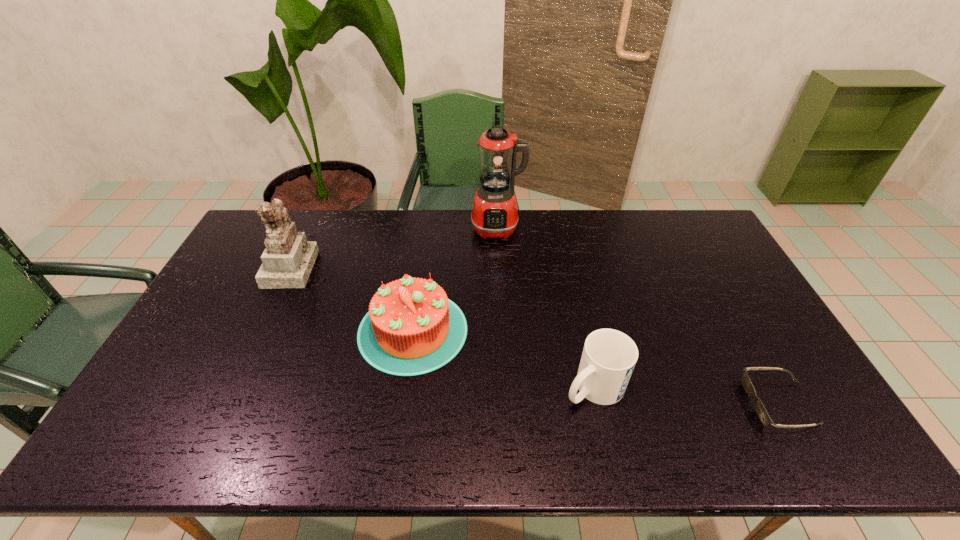
Identify the location of vacant region that satisfies the following two spatial constraints: 1. on the front-facing side of the second tallest object; 2. on the left side of the third shortest object. The image size is (960, 540). (261, 330).

The width and height of the screenshot is (960, 540). Find the location of `free space that satisfies the following two spatial constraints: 1. on the controls of the tallest object; 2. on the front-facing side of the second farthest object`. free space that satisfies the following two spatial constraints: 1. on the controls of the tallest object; 2. on the front-facing side of the second farthest object is located at coordinates (499, 267).

This screenshot has height=540, width=960. Identify the location of free space that satisfies the following two spatial constraints: 1. on the front-facing side of the second tallest object; 2. on the right side of the third tallest object. (261, 330).

Locate an element on the screen. Image resolution: width=960 pixels, height=540 pixels. vacant point that satisfies the following two spatial constraints: 1. on the controls of the food processor; 2. on the front-facing side of the second farthest object is located at coordinates (499, 267).

At what (x,y) coordinates should I click in order to perform the action: click on free point that satisfies the following two spatial constraints: 1. on the controls of the tallest object; 2. on the right side of the second shortest object. Please return your answer as a coordinate pair (x, y). The image size is (960, 540). Looking at the image, I should click on (505, 387).